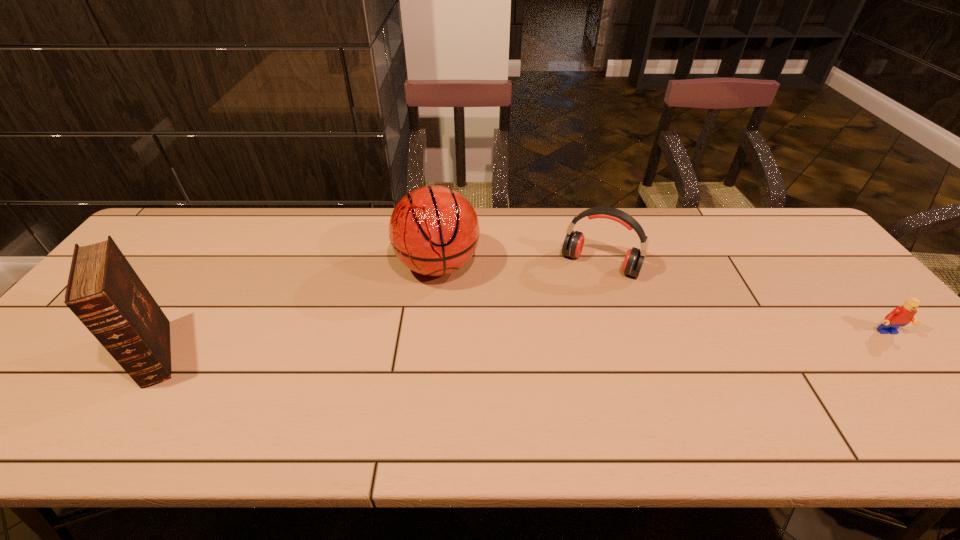
Find the location of `Bible`. Bible is located at coordinates (105, 293).

This screenshot has height=540, width=960. In order to click on the rightmost object in this screenshot , I will do `click(902, 315)`.

At what (x,y) coordinates should I click in order to perform the action: click on Lego. Please return your answer as a coordinate pair (x, y). The image size is (960, 540). Looking at the image, I should click on (902, 315).

Locate an element on the screen. Image resolution: width=960 pixels, height=540 pixels. earphone is located at coordinates (573, 244).

Find the location of a particular element. Image resolution: width=960 pixels, height=540 pixels. the third object from left to right is located at coordinates (573, 244).

Find the location of a particular element. basketball is located at coordinates (434, 230).

You are a GUI agent. You are given a task and a screenshot of the screen. Output one action in this format:
    pyautogui.click(x=<x>, y=<y>)
    Task: Click on the vacant space positioned on the right of the Bible
    
    Given the screenshot: What is the action you would take?
    pyautogui.click(x=228, y=354)

You are a GUI agent. You are given a task and a screenshot of the screen. Output one action in this format:
    pyautogui.click(x=<x>, y=<y>)
    Task: Click on the free space located 0.100m on the front-facing side of the shortest object
    The width and height of the screenshot is (960, 540).
    Given the screenshot: What is the action you would take?
    pyautogui.click(x=921, y=373)

Locate an element on the screen. The image size is (960, 540). vacant region located 0.070m on the ear cups of the second object from right to left is located at coordinates (580, 297).

Locate an element on the screen. This screenshot has height=540, width=960. free space located 0.290m on the ear cups of the second object from right to left is located at coordinates (551, 356).